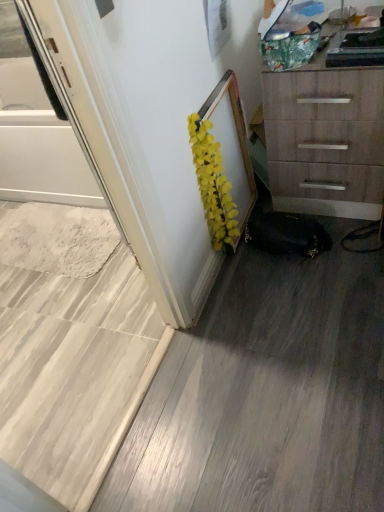
Question: Is white glossy screen door at left outside of yellow artificial flowers at center?

Choices:
 (A) yes
 (B) no

Answer: (A)

Question: Can you confirm if white glossy screen door at left is smaller than yellow artificial flowers at center?

Choices:
 (A) no
 (B) yes

Answer: (A)

Question: Is white glossy screen door at left facing away from yellow artificial flowers at center?

Choices:
 (A) yes
 (B) no

Answer: (B)

Question: Considering the relative sizes of white glossy screen door at left and yellow artificial flowers at center in the image provided, is white glossy screen door at left wider than yellow artificial flowers at center?

Choices:
 (A) yes
 (B) no

Answer: (A)

Question: Can you confirm if white glossy screen door at left is thinner than yellow artificial flowers at center?

Choices:
 (A) yes
 (B) no

Answer: (B)

Question: Do you think yellow artificial flowers at center is within white glossy screen door at left, or outside of it?

Choices:
 (A) inside
 (B) outside

Answer: (B)

Question: Is point (203, 162) closer or farther from the camera than point (69, 150)?

Choices:
 (A) farther
 (B) closer

Answer: (B)

Question: In terms of height, does yellow artificial flowers at center look taller or shorter compared to white glossy screen door at left?

Choices:
 (A) tall
 (B) short

Answer: (B)

Question: Considering the positions of yellow artificial flowers at center and white glossy screen door at left in the image, is yellow artificial flowers at center wider or thinner than white glossy screen door at left?

Choices:
 (A) thin
 (B) wide

Answer: (A)

Question: Which is correct: wooden chest of drawers at upper right is inside yellow artificial flowers at center, or outside of it?

Choices:
 (A) outside
 (B) inside

Answer: (A)

Question: Looking at their shapes, would you say wooden chest of drawers at upper right is wider or thinner than yellow artificial flowers at center?

Choices:
 (A) thin
 (B) wide

Answer: (B)

Question: From the image's perspective, relative to yellow artificial flowers at center, is wooden chest of drawers at upper right above or below?

Choices:
 (A) above
 (B) below

Answer: (A)

Question: Based on their positions, is wooden chest of drawers at upper right located to the left or right of yellow artificial flowers at center?

Choices:
 (A) right
 (B) left

Answer: (A)

Question: Is white glossy screen door at left in front of or behind yellow artificial flowers at center in the image?

Choices:
 (A) front
 (B) behind

Answer: (A)

Question: Does point (19, 100) appear closer or farther from the camera than point (200, 180)?

Choices:
 (A) farther
 (B) closer

Answer: (A)